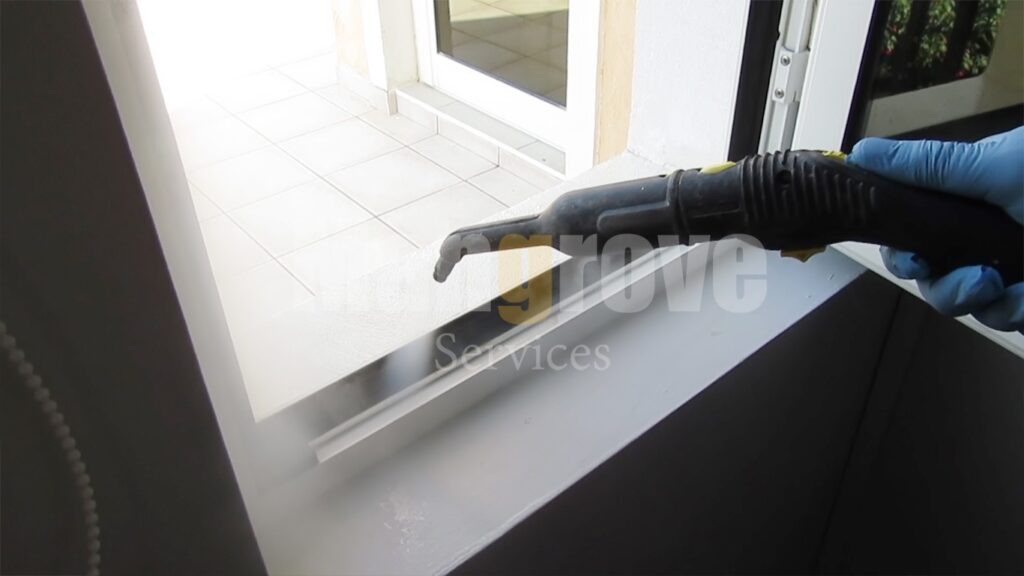
Where is `silver rivet on window frame`? This screenshot has height=576, width=1024. silver rivet on window frame is located at coordinates (777, 94).